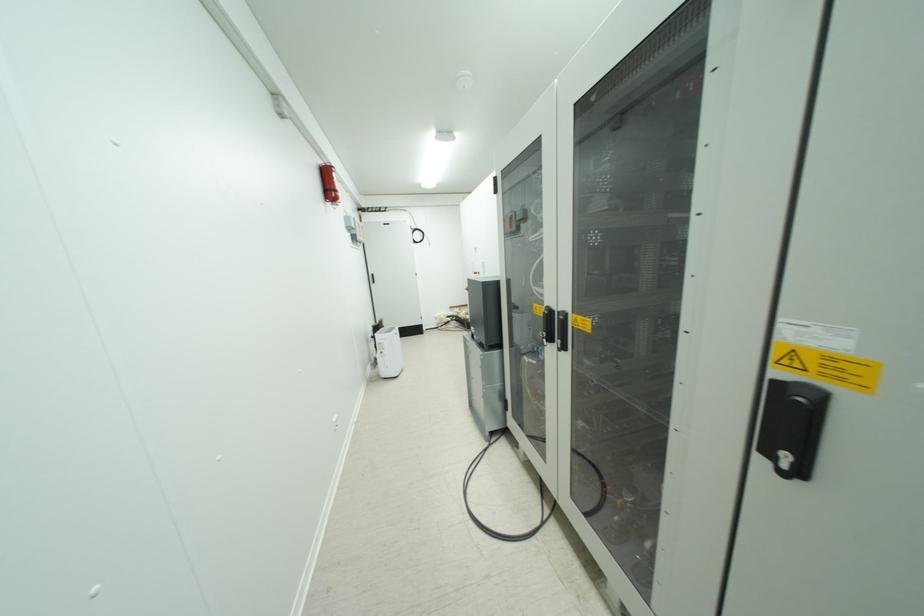
This screenshot has width=924, height=616. I want to click on black door handle, so click(795, 439).